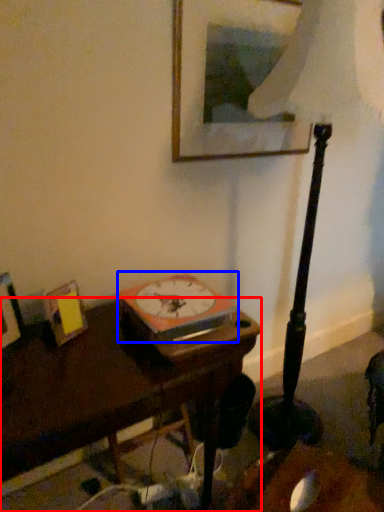
Question: Among these objects, which one is nearest to the camera, table (highlighted by a red box) or paperback book (highlighted by a blue box)?

Choices:
 (A) table
 (B) paperback book

Answer: (A)